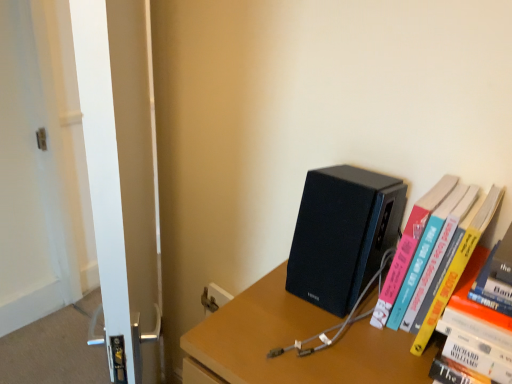
Question: Is point (421, 344) positioned closer to the camera than point (271, 317)?

Choices:
 (A) closer
 (B) farther

Answer: (A)

Question: Is hardcover book at right bigger or smaller than matte black speaker at upper right?

Choices:
 (A) small
 (B) big

Answer: (A)

Question: Considering the real-world distances, which object is farthest from the hardcover book at right?

Choices:
 (A) black matte speaker at center-right
 (B) matte black speaker at upper right
 (C) white glossy screen door at left

Answer: (C)

Question: Which is farther from the hardcover book at right?

Choices:
 (A) black matte speaker at center-right
 (B) matte black speaker at upper right
 (C) white glossy screen door at left

Answer: (C)